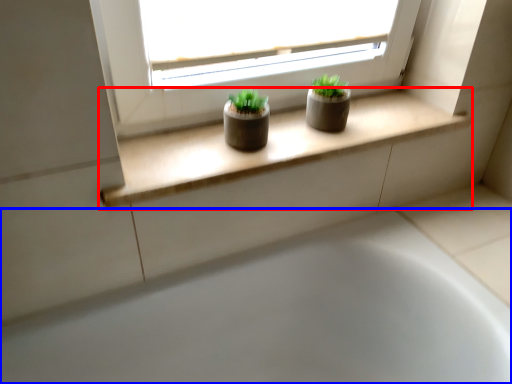
Question: Which object appears closest to the camera in this image, window sill (highlighted by a red box) or bathtub (highlighted by a blue box)?

Choices:
 (A) window sill
 (B) bathtub

Answer: (B)